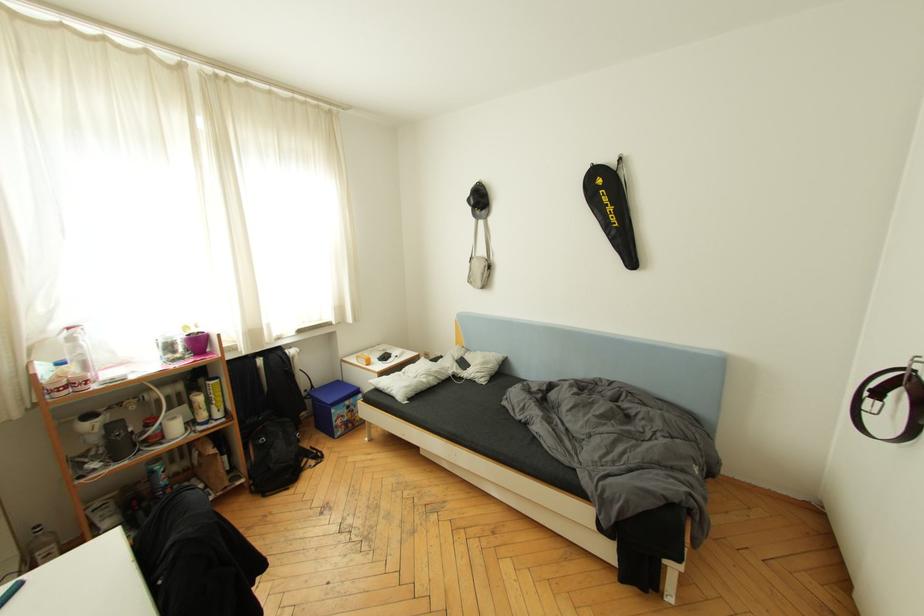
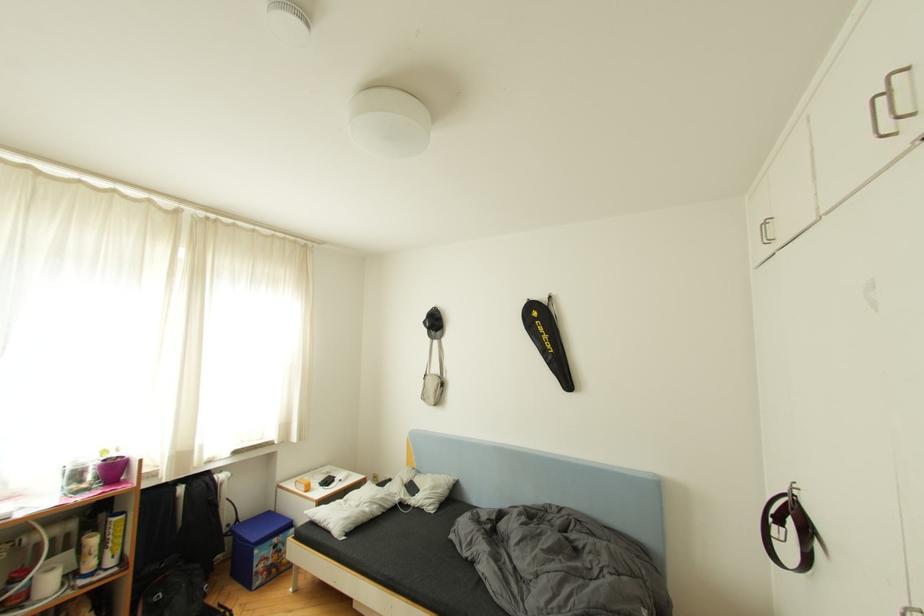
What movement of the cameraman would produce the second image?

The cameraman moved toward right, backward.